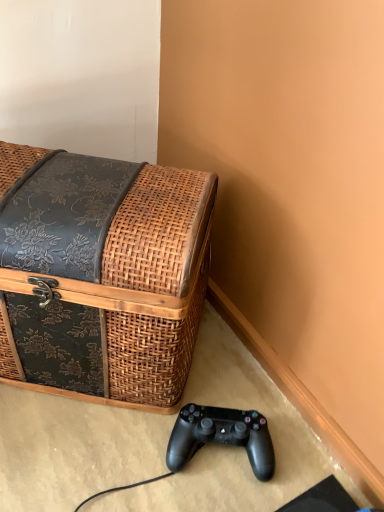
The image size is (384, 512). I want to click on free location to the right of black matte game controller at lower center, so click(299, 462).